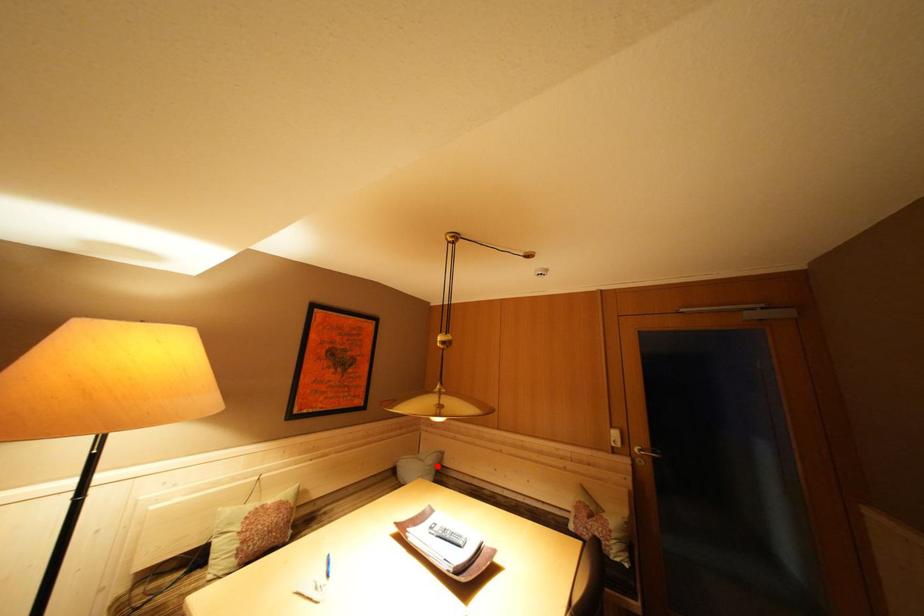
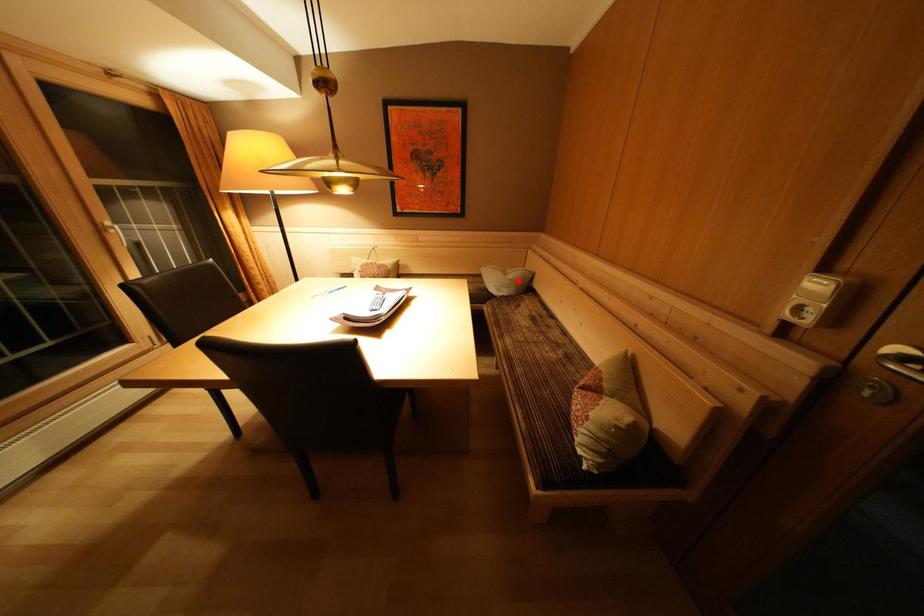
I am providing you with two images of the same scene from different viewpoints. A red point is marked on the first image and another point is marked on the second image. Is the red point in image1 aligned with the point shown in image2?

Yes